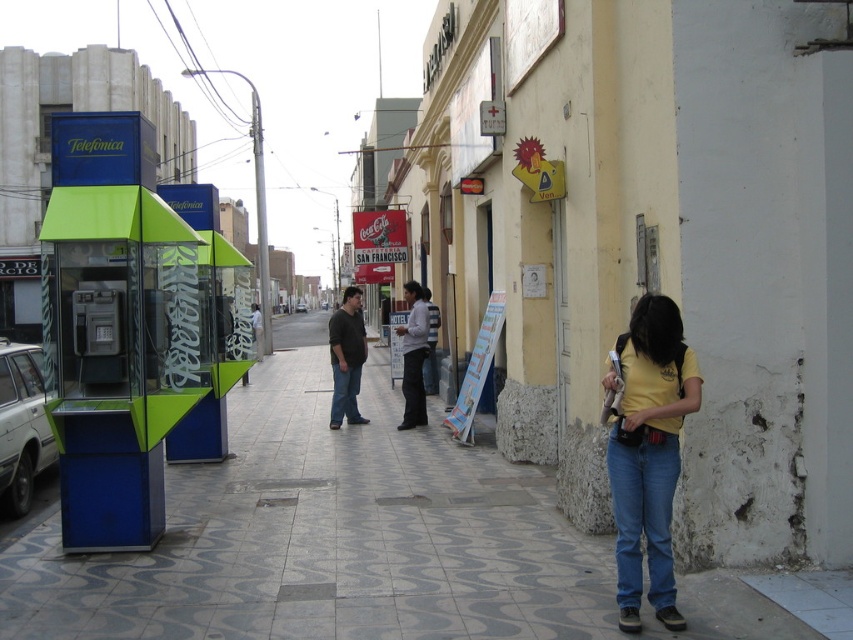
Question: Considering the relative positions of blue denim jeans at lower right and white shirt at center in the image provided, where is blue denim jeans at lower right located with respect to white shirt at center?

Choices:
 (A) below
 (B) above

Answer: (A)

Question: Which object is the closest to the blue denim jeans at lower right?

Choices:
 (A) white shirt at center
 (B) blue denim jeans at center

Answer: (A)

Question: Which object is farther from the camera taking this photo?

Choices:
 (A) white shirt at center
 (B) gray concrete sidewalk at center
 (C) dark gray sweater at center
 (D) blue denim jeans at center

Answer: (D)

Question: Considering the real-world distances, which object is closest to the blue denim jeans at center?

Choices:
 (A) yellow matte shirt at lower right
 (B) dark gray sweater at center
 (C) white shirt at center

Answer: (B)

Question: Observing the image, what is the correct spatial positioning of gray concrete sidewalk at center in reference to white shirt at center?

Choices:
 (A) left
 (B) right

Answer: (A)

Question: Is yellow matte shirt at lower right wider than white shirt at center?

Choices:
 (A) no
 (B) yes

Answer: (B)